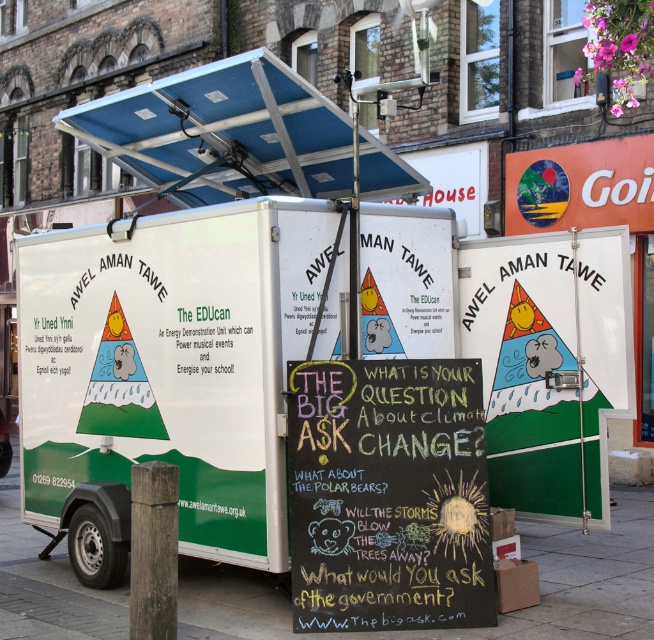
Is point (177, 424) farther from camera compared to point (390, 180)?

No, it is not.

Locate an element on the screen. white matte trailer at center is located at coordinates (177, 362).

Does point (477, 241) lie behind point (542, 620)?

That is True.

Which is above, white matte sign at center or green concrete pavement at lower center?

white matte sign at center

At what (x,y) coordinates should I click in order to perform the action: click on white matte sign at center. Please return your answer as a coordinate pair (x, y). This screenshot has height=640, width=654. Looking at the image, I should click on (549, 364).

How far apart are green concrete pavement at lower center and blue metallic canopy at upper center?

green concrete pavement at lower center and blue metallic canopy at upper center are 2.91 meters apart from each other.

Describe the element at coordinates (496, 614) in the screenshot. I see `green concrete pavement at lower center` at that location.

Is point (405, 634) positioned behind point (171, 124)?

That is False.

Locate an element on the screen. green concrete pavement at lower center is located at coordinates (496, 614).